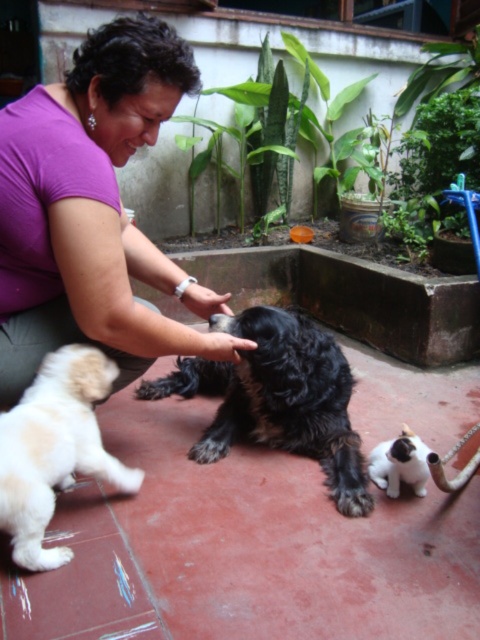
You are a photographer trying to capture a photo of the light beige fur at lower left and the white fur cat at lower right. Which animal should you focus on first if you want to include both in the frame without moving the camera?

The light beige fur at lower left is much taller than the white fur cat at lower right, so you should focus on the light beige fur at lower left first to ensure both are in the frame.

You are a tailor measuring fabrics for a new project. You have a pattern that requires a piece of fabric wider than the light beige fur at lower left. Do you have enough width in the purple fabric at center to use for this project?

The purple fabric at center has a larger width than the light beige fur at lower left, so yes, the purple fabric at center can be used since it meets the required width.

You are a photographer trying to capture a photo of the black furry dog at center and the light beige fur at lower left. Since you want both subjects to be in focus, you need to know which one is closer to you. Can you determine which animal is closer based on their sizes?

The black furry dog at center is taller than light beige fur at lower left, so the light beige fur at lower left is closer to you because smaller objects in a photo are typically closer to the camera.